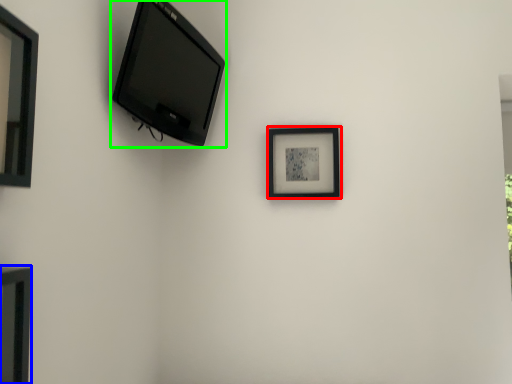
Question: Which object is positioned farthest from picture frame (highlighted by a red box)? Select from picture frame (highlighted by a blue box) and television (highlighted by a green box).

Choices:
 (A) picture frame
 (B) television

Answer: (A)